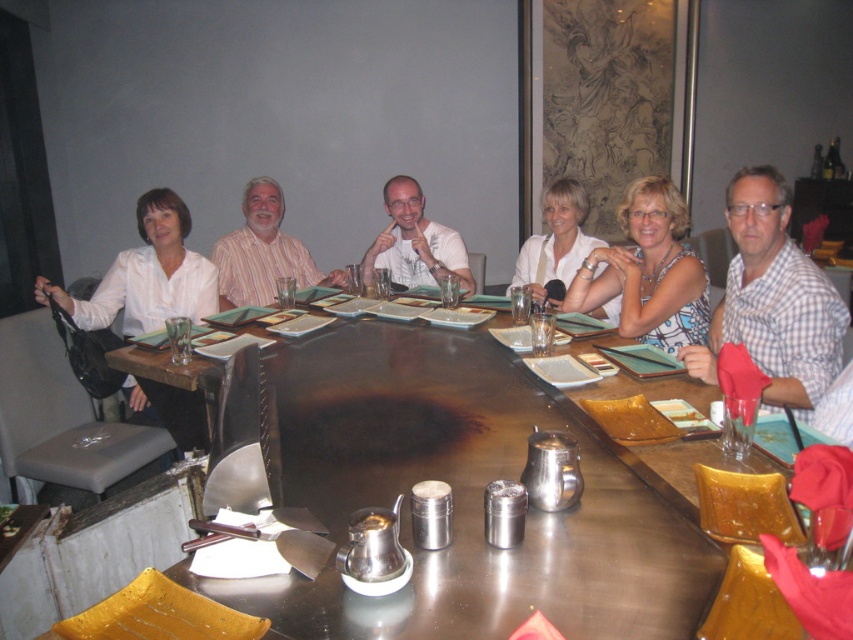
Is white checkered shirt at right bigger than matte white blouse at left?

Yes.

Who is more forward, (781, 403) or (112, 316)?

Point (781, 403)

The image size is (853, 640). Describe the element at coordinates (773, 300) in the screenshot. I see `white checkered shirt at right` at that location.

I want to click on white checkered shirt at right, so 773,300.

Between matte white blouse at left and striped cotton shirt at center, which one is positioned higher?

striped cotton shirt at center is higher up.

Can you confirm if matte white blouse at left is bigger than striped cotton shirt at center?

Yes.

Is point (144, 401) farther from viewer compared to point (294, 259)?

No.

What are the coordinates of `matte white blouse at left` in the screenshot? It's located at (148, 275).

In the scene shown: Who is shorter, white textured blouse at center or white fabric shirt at center?

With less height is white textured blouse at center.

Measure the distance between point (616, 292) and camera.

Point (616, 292) is 2.79 meters away from camera.

Measure the distance between white textured blouse at center and camera.

A distance of 7.95 feet exists between white textured blouse at center and camera.

Identify the location of white textured blouse at center. Image resolution: width=853 pixels, height=640 pixels. (648, 272).